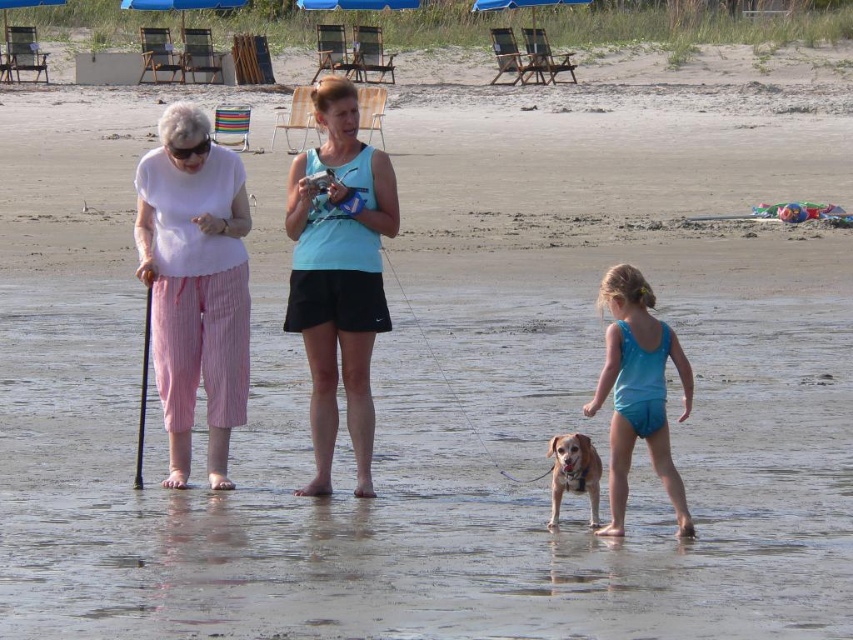
Question: Which object is closer to the camera taking this photo?

Choices:
 (A) blue fabric umbrella at upper center
 (B) clear water at lower center
 (C) brown fur dog at center

Answer: (B)

Question: In this image, where is brown fur dog at center located relative to blue fabric umbrella at upper center?

Choices:
 (A) below
 (B) above

Answer: (A)

Question: Estimate the real-world distances between objects in this image. Which object is farther from the clear water at lower center?

Choices:
 (A) blue fabric swimsuit at lower right
 (B) blue fabric umbrella at upper center
 (C) pink striped pants at left

Answer: (B)

Question: Based on their relative distances, which object is nearer to the clear water at lower center?

Choices:
 (A) light blue fabric tank top at center
 (B) brown fur dog at center

Answer: (B)

Question: Is light blue fabric tank top at center closer to the viewer compared to brown fur dog at center?

Choices:
 (A) no
 (B) yes

Answer: (A)

Question: Is pink striped pants at left smaller than brown fur dog at center?

Choices:
 (A) no
 (B) yes

Answer: (A)